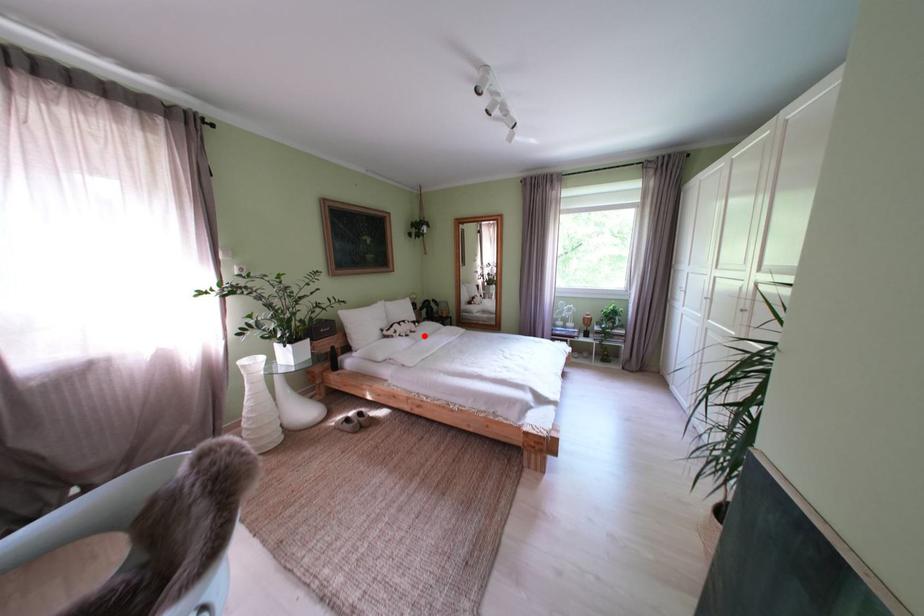
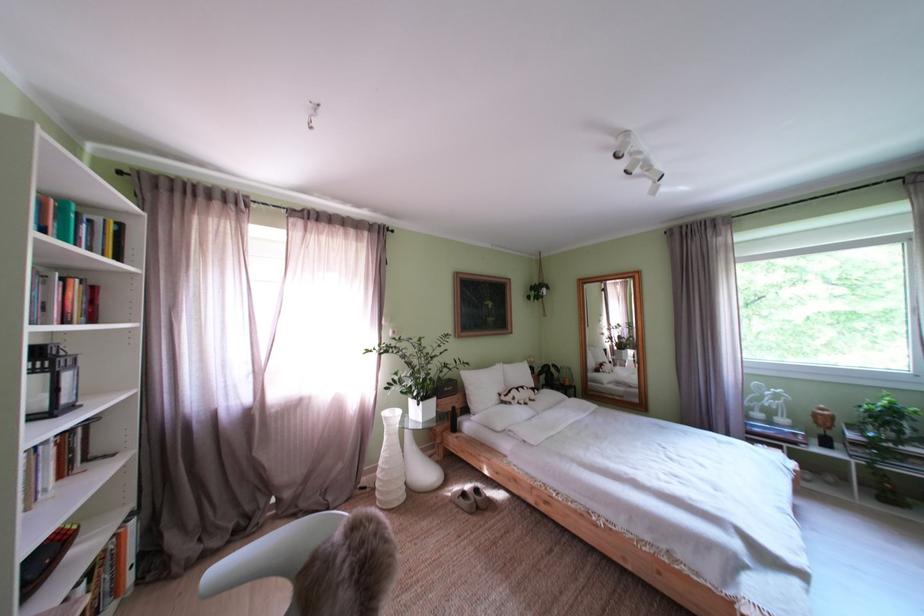
Find the pixel in the second image that matches the highlighted location in the first image.

(543, 403)